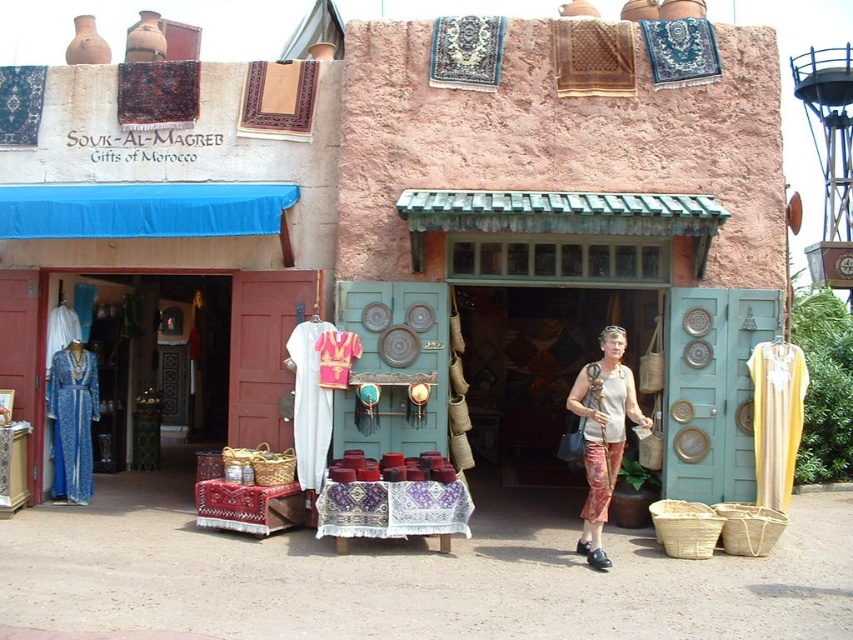
You are a customer standing at the entrance of the shop and want to buy the matte beige purse at center. Where should you look to find it?

The matte beige purse at center is located at point [602,435], so you should look towards the center of the shop to find it.